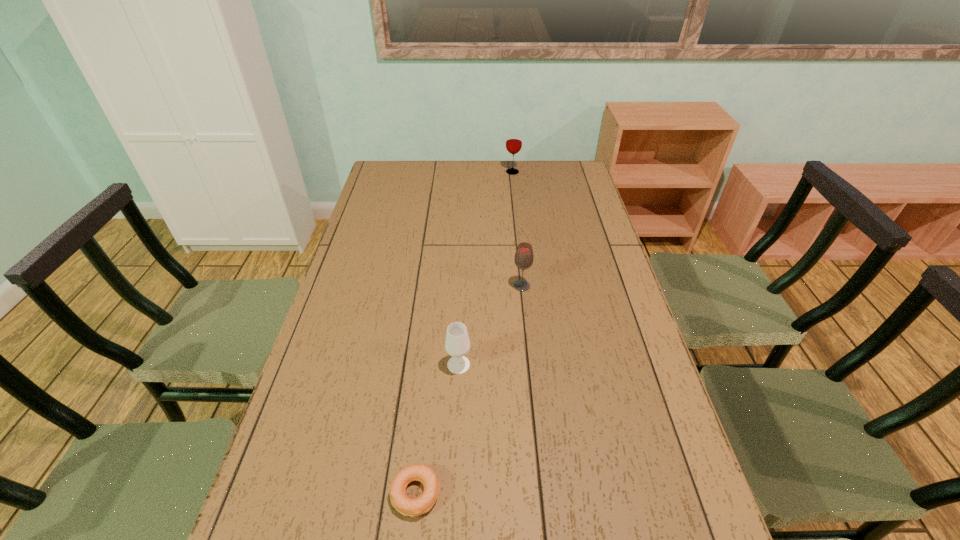
The width and height of the screenshot is (960, 540). I want to click on free spot between the third nearest object and the bagel, so click(468, 390).

Locate an element on the screen. The width and height of the screenshot is (960, 540). empty location between the farthest glass and the second farthest object is located at coordinates (517, 229).

The image size is (960, 540). I want to click on object that stands as the third closest to the second farthest object, so click(x=514, y=137).

The image size is (960, 540). What are the coordinates of `object that is the closest to the bagel` in the screenshot? It's located at (457, 344).

Where is `glass that stands as the second closest to the second farthest object`? glass that stands as the second closest to the second farthest object is located at coordinates (514, 137).

Image resolution: width=960 pixels, height=540 pixels. Identify the location of glass identified as the closest to the third nearest object. coord(457,344).

Locate an element on the screen. free space that satisfies the following two spatial constraints: 1. on the back side of the farthest object; 2. on the right side of the third farthest object is located at coordinates (468, 172).

Locate an element on the screen. This screenshot has width=960, height=540. vacant space that satisfies the following two spatial constraints: 1. on the back side of the nearest object; 2. on the left side of the farthest object is located at coordinates (449, 172).

Find the location of a particular element. free point that satisfies the following two spatial constraints: 1. on the back side of the third farthest object; 2. on the right side of the bagel is located at coordinates (429, 364).